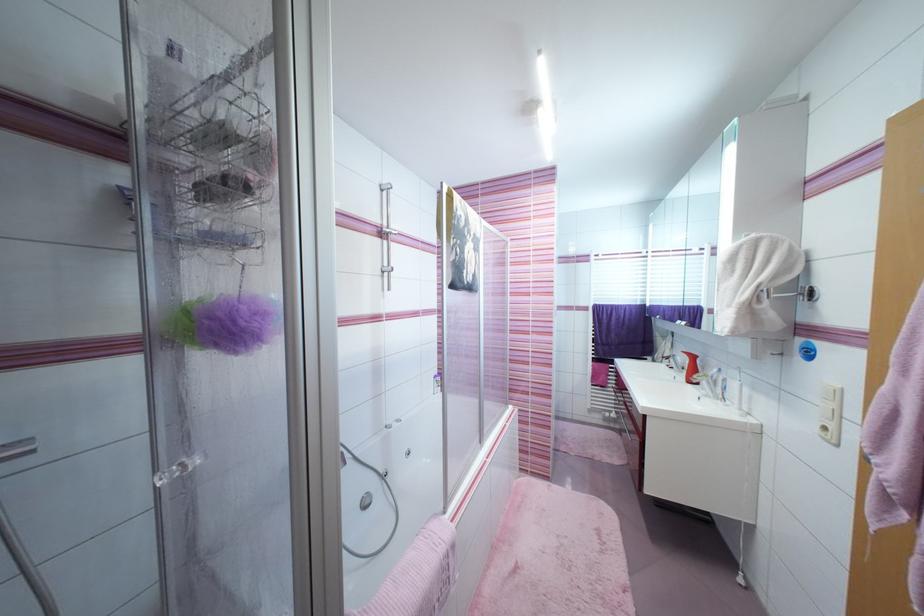
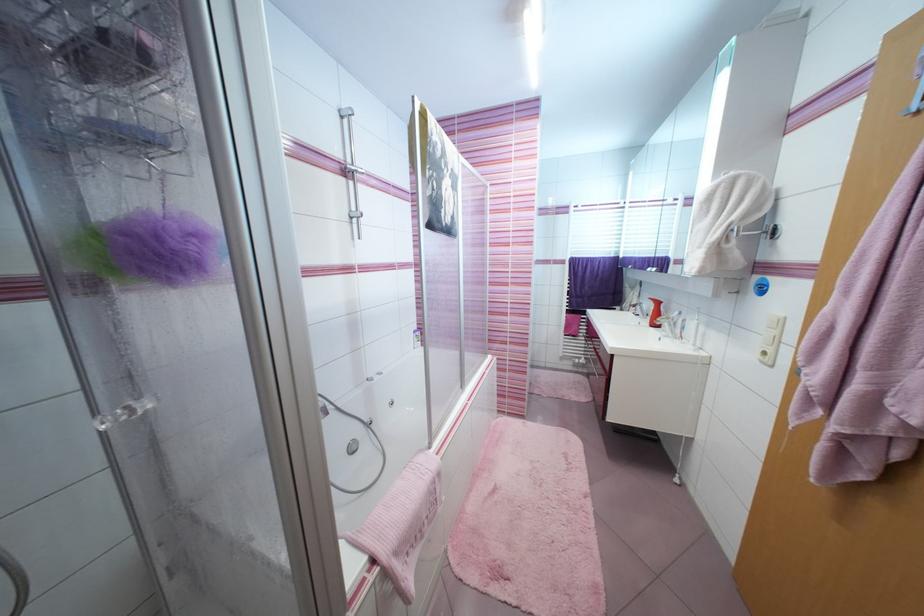
Question: How did the camera likely rotate?

Choices:
 (A) Left
 (B) Right
 (C) Up
 (D) Down

Answer: (D)